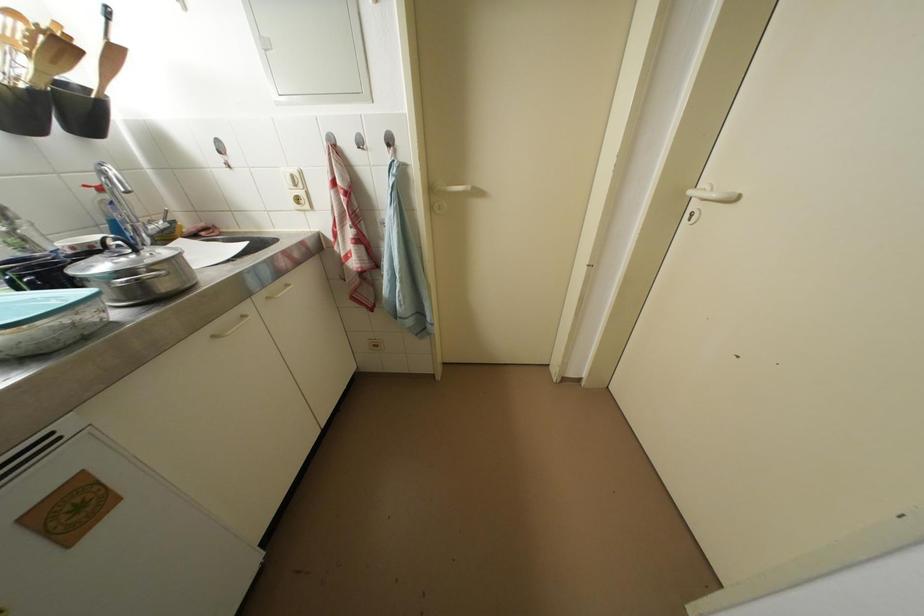
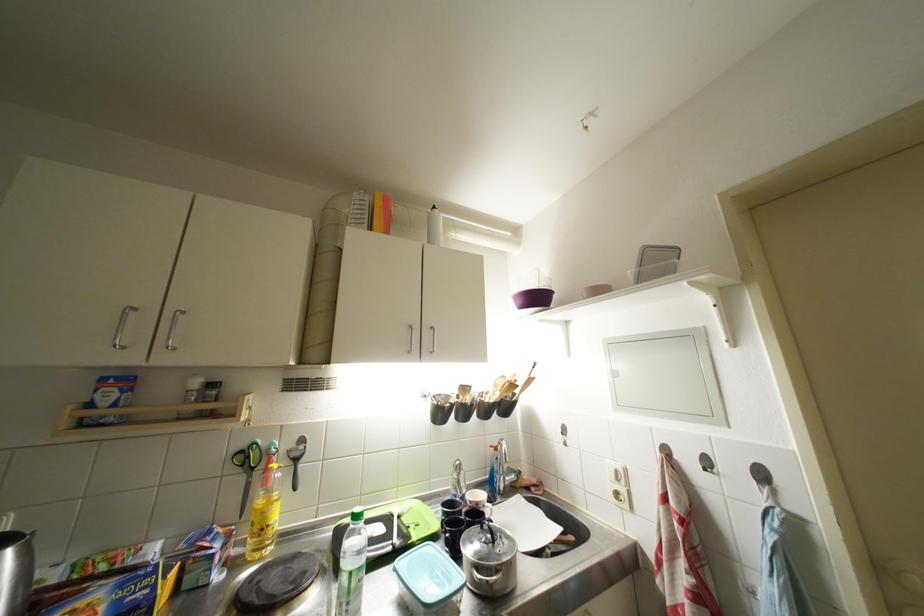
Locate, in the second image, the point that corresponds to point 367,146 in the first image.

(714, 467)